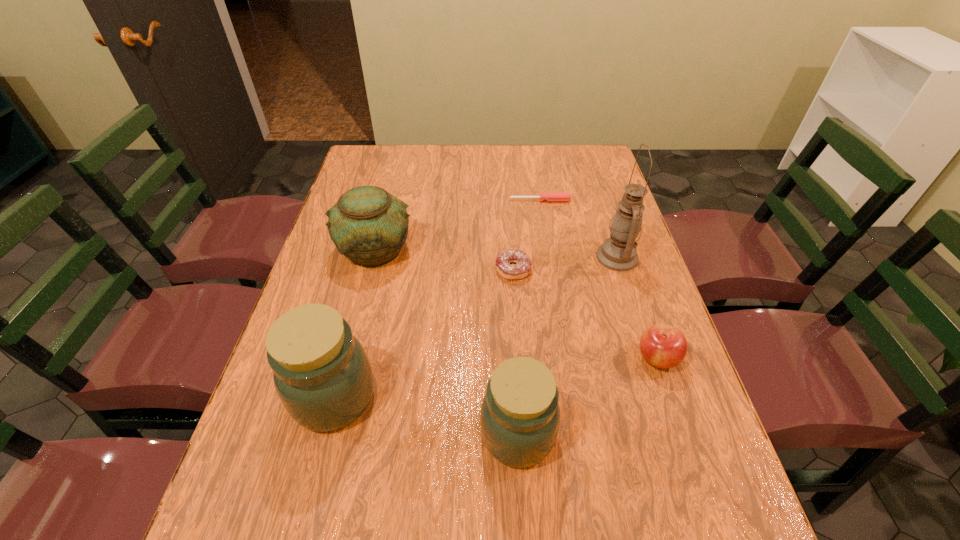
Identify the location of oil lamp that is at the right edge. This screenshot has width=960, height=540. (619, 252).

Identify the location of apple located at the right edge. (664, 346).

This screenshot has width=960, height=540. I want to click on free space at the far edge of the desktop, so click(x=429, y=156).

Where is `blank area at the near edge`? This screenshot has width=960, height=540. blank area at the near edge is located at coordinates [432, 478].

Find the location of a particular element. The width and height of the screenshot is (960, 540). vacant space at the left edge of the desktop is located at coordinates (348, 261).

Locate an element on the screen. free point at the right edge is located at coordinates (602, 291).

Where is `vacant space at the far left corner of the desktop`? The image size is (960, 540). vacant space at the far left corner of the desktop is located at coordinates (394, 161).

I want to click on vacant space at the near left corner, so click(326, 463).

In the image, there is a desktop. Where is `vacant space at the far right corner`? The width and height of the screenshot is (960, 540). vacant space at the far right corner is located at coordinates (566, 152).

Locate an element on the screen. This screenshot has width=960, height=540. unoccupied position between the pottery and the sixth shortest object is located at coordinates (355, 323).